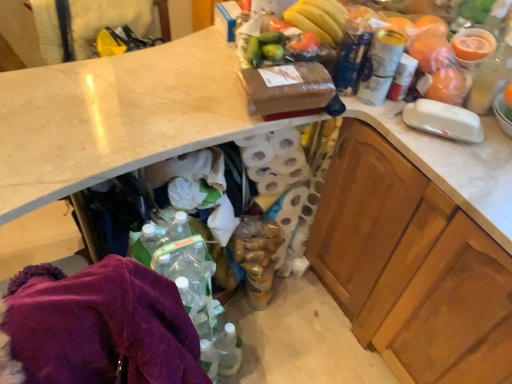
Question: Can you confirm if wooden cabinet at right is bigger than translucent plastic cup at upper right, arranged as the 1th bottle when viewed from the right?

Choices:
 (A) yes
 (B) no

Answer: (A)

Question: Could you tell me if wooden cabinet at right is facing translucent plastic cup at upper right, which is counted as the 2th bottle, starting from the left?

Choices:
 (A) yes
 (B) no

Answer: (B)

Question: From the image's perspective, is wooden cabinet at right under translucent plastic cup at upper right, arranged as the 1th bottle when viewed from the right?

Choices:
 (A) no
 (B) yes

Answer: (B)

Question: Is wooden cabinet at right not close to translucent plastic cup at upper right, arranged as the 1th bottle when viewed from the right?

Choices:
 (A) yes
 (B) no

Answer: (B)

Question: Would you say wooden cabinet at right is outside translucent plastic cup at upper right, arranged as the 1th bottle when viewed from the right?

Choices:
 (A) yes
 (B) no

Answer: (A)

Question: Is translucent plastic cup at upper right, arranged as the 1th bottle when viewed from the right, surrounded by wooden cabinet at right?

Choices:
 (A) yes
 (B) no

Answer: (B)

Question: Is translucent plastic cup at upper right, arranged as the 1th bottle when viewed from the right, positioned far away from wooden cabinet at right?

Choices:
 (A) yes
 (B) no

Answer: (B)

Question: From a real-world perspective, is translucent plastic cup at upper right, which is counted as the 2th bottle, starting from the left, positioned under wooden cabinet at right based on gravity?

Choices:
 (A) yes
 (B) no

Answer: (B)

Question: Can you see translucent plastic cup at upper right, arranged as the 1th bottle when viewed from the right, touching wooden cabinet at right?

Choices:
 (A) no
 (B) yes

Answer: (A)

Question: Could wooden cabinet at right be considered to be inside translucent plastic cup at upper right, which is counted as the 2th bottle, starting from the left?

Choices:
 (A) no
 (B) yes

Answer: (A)

Question: Does translucent plastic cup at upper right, which is counted as the 2th bottle, starting from the left, appear on the left side of wooden cabinet at right?

Choices:
 (A) no
 (B) yes

Answer: (A)

Question: Is translucent plastic cup at upper right, which is counted as the 2th bottle, starting from the left, taller than wooden cabinet at right?

Choices:
 (A) yes
 (B) no

Answer: (B)

Question: Is wooden cabinet at right shorter than white textured toilet paper at center?

Choices:
 (A) yes
 (B) no

Answer: (B)